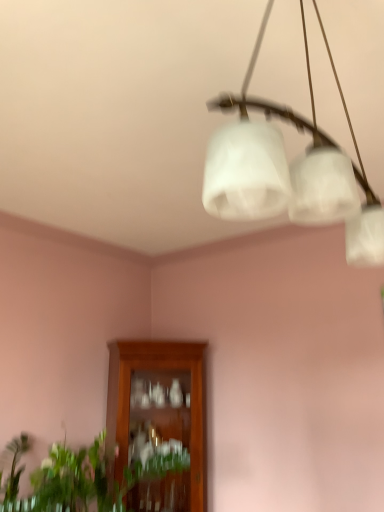
Question: Does green leafy plant at lower left have a lesser width compared to white frosted glass chandelier at upper center?

Choices:
 (A) no
 (B) yes

Answer: (A)

Question: Is green leafy plant at lower left oriented away from white frosted glass chandelier at upper center?

Choices:
 (A) yes
 (B) no

Answer: (B)

Question: Is green leafy plant at lower left far away from white frosted glass chandelier at upper center?

Choices:
 (A) no
 (B) yes

Answer: (B)

Question: Considering the relative sizes of green leafy plant at lower left and white frosted glass chandelier at upper center in the image provided, is green leafy plant at lower left wider than white frosted glass chandelier at upper center?

Choices:
 (A) yes
 (B) no

Answer: (A)

Question: Considering the relative sizes of green leafy plant at lower left and white frosted glass chandelier at upper center in the image provided, is green leafy plant at lower left smaller than white frosted glass chandelier at upper center?

Choices:
 (A) yes
 (B) no

Answer: (B)

Question: Considering the positions of point (167, 445) and point (211, 157), is point (167, 445) closer or farther from the camera than point (211, 157)?

Choices:
 (A) closer
 (B) farther

Answer: (B)

Question: From the image's perspective, is green leafy plant at lower left located above or below white frosted glass chandelier at upper center?

Choices:
 (A) above
 (B) below

Answer: (B)

Question: In terms of width, does green leafy plant at lower left look wider or thinner when compared to white frosted glass chandelier at upper center?

Choices:
 (A) thin
 (B) wide

Answer: (B)

Question: Is green leafy plant at lower left in front of or behind white frosted glass chandelier at upper center in the image?

Choices:
 (A) front
 (B) behind

Answer: (B)

Question: From a real-world perspective, is green leafy plant at lower left above or below wooden cabinet at center?

Choices:
 (A) above
 (B) below

Answer: (B)

Question: Looking at their shapes, would you say green leafy plant at lower left is wider or thinner than wooden cabinet at center?

Choices:
 (A) thin
 (B) wide

Answer: (B)

Question: Is green leafy plant at lower left situated inside wooden cabinet at center or outside?

Choices:
 (A) inside
 (B) outside

Answer: (B)

Question: Considering the positions of green leafy plant at lower left and wooden cabinet at center in the image, is green leafy plant at lower left bigger or smaller than wooden cabinet at center?

Choices:
 (A) small
 (B) big

Answer: (A)

Question: Is white frosted glass chandelier at upper center inside or outside of green leafy plant at lower left?

Choices:
 (A) outside
 (B) inside

Answer: (A)

Question: From the image's perspective, is white frosted glass chandelier at upper center located above or below green leafy plant at lower left?

Choices:
 (A) above
 (B) below

Answer: (A)